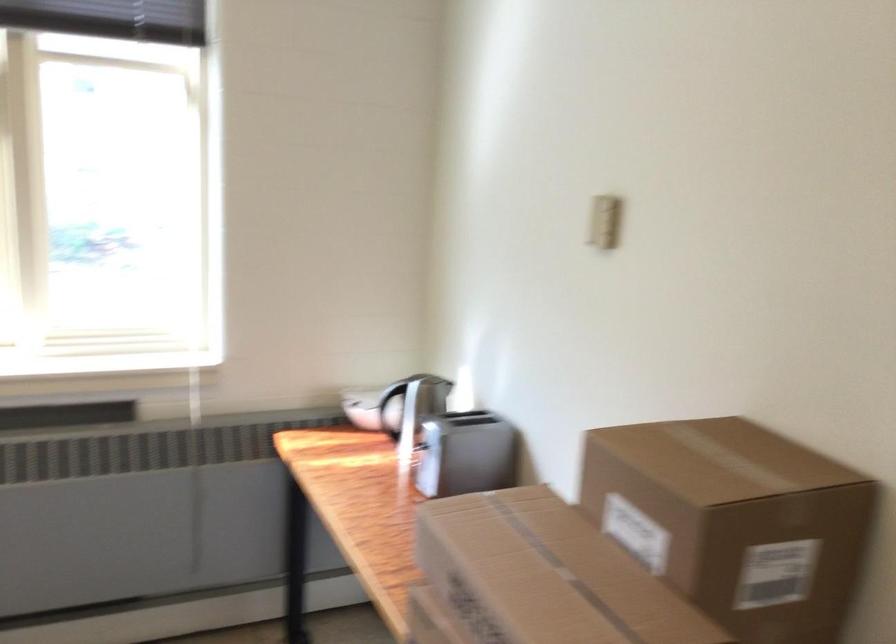
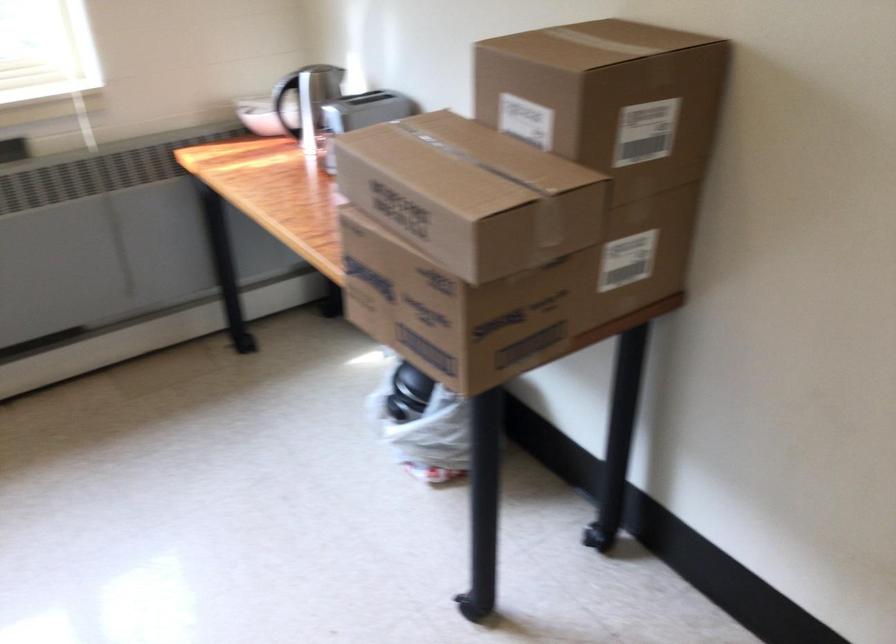
In the second image, find the point that corresponds to point 363,415 in the first image.

(257, 115)